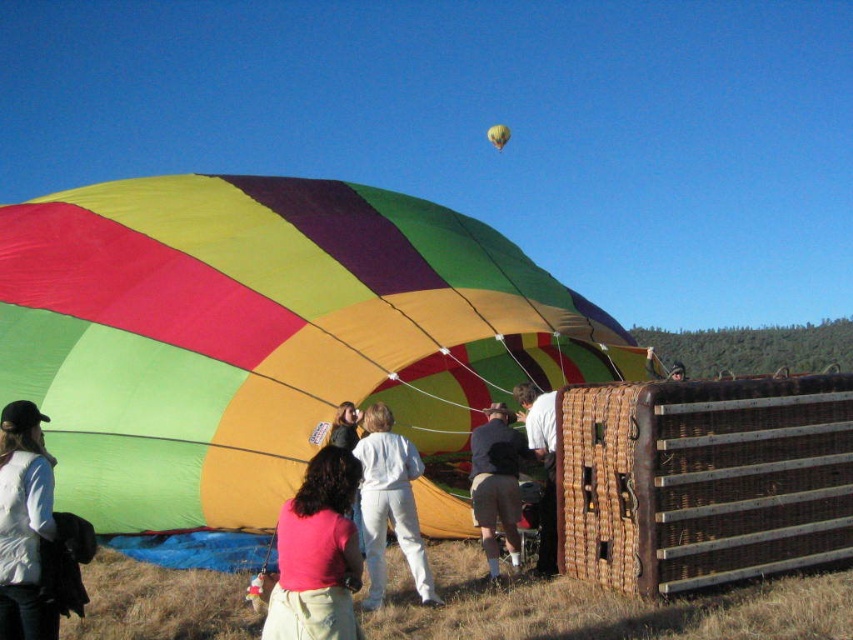
Is white cotton shirt at lower left to the right of pink fabric shirt at center from the viewer's perspective?

Incorrect, white cotton shirt at lower left is not on the right side of pink fabric shirt at center.

Is white cotton shirt at lower left positioned before pink fabric shirt at center?

That is True.

Between point (24, 531) and point (340, 444), which one is positioned behind?

Positioned behind is point (340, 444).

I want to click on white cotton shirt at lower left, so click(24, 522).

Does point (564, 468) lie in front of point (486, 556)?

That is True.

Is point (665, 531) closer to viewer compared to point (496, 464)?

Yes, it is.

The height and width of the screenshot is (640, 853). Identify the location of woven wicker basket at lower right. (703, 481).

Between point (242, 516) and point (677, 378), which one is positioned in front?

Point (242, 516) is more forward.

Can you confirm if multicolored fabric hot air balloon at center is wider than matte black helmet at center?

Yes, multicolored fabric hot air balloon at center is wider than matte black helmet at center.

Between point (178, 356) and point (674, 362), which one is positioned in front?

Point (178, 356) is more forward.

What are the coordinates of `multicolored fabric hot air balloon at center` in the screenshot? It's located at (265, 333).